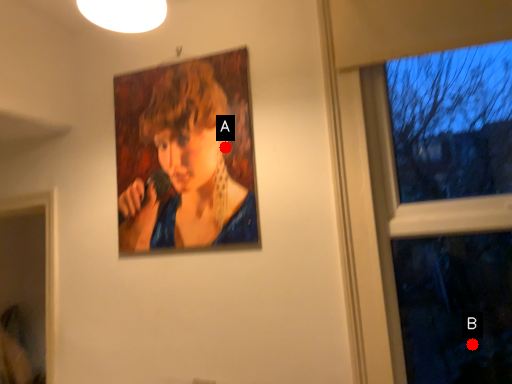
Question: Two points are circled on the image, labeled by A and B beside each circle. Which point is farther to the camera?

Choices:
 (A) A is further
 (B) B is further

Answer: (A)